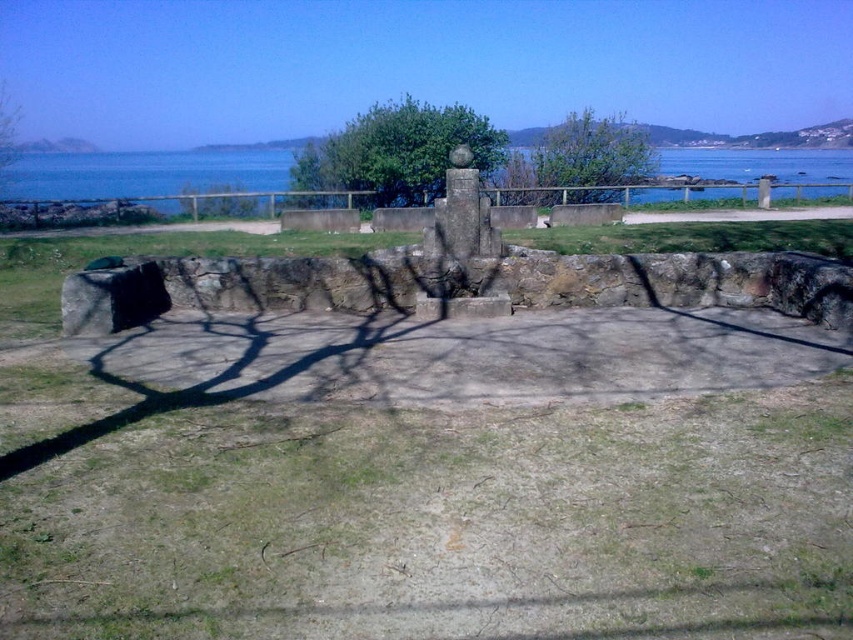
Between point (666, 198) and point (627, 173), which one is positioned in front?

Point (666, 198)

Between point (813, 156) and point (584, 172), which one is positioned behind?

Point (813, 156)

This screenshot has width=853, height=640. What are the coordinates of `blue water at upper center` in the screenshot? It's located at (142, 173).

Is blue water at upper center further to the viewer compared to green leafy tree at center?

No, it is in front of green leafy tree at center.

Is blue water at upper center thinner than green leafy tree at center?

No.

Which is behind, point (155, 186) or point (408, 161)?

Positioned behind is point (155, 186).

Locate an element on the screen. blue water at upper center is located at coordinates (142, 173).

From the picture: Is green leafy tree at center wider than green leafy tree at upper center?

Yes, green leafy tree at center is wider than green leafy tree at upper center.

What do you see at coordinates (397, 152) in the screenshot? I see `green leafy tree at center` at bounding box center [397, 152].

Between point (376, 120) and point (552, 184), which one is positioned in front?

Point (376, 120)

Identify the location of green leafy tree at center. Image resolution: width=853 pixels, height=640 pixels. pos(397,152).